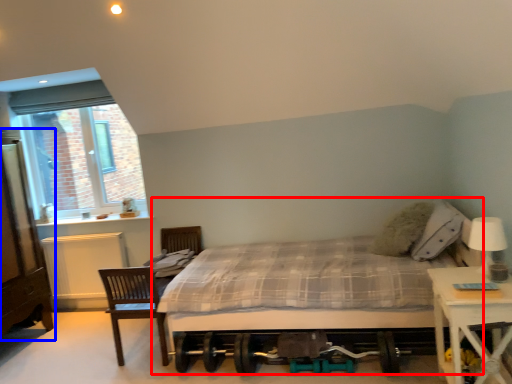
Question: Which of the following is the closest to the observer, bed (highlighted by a red box) or dresser (highlighted by a blue box)?

Choices:
 (A) bed
 (B) dresser

Answer: (A)